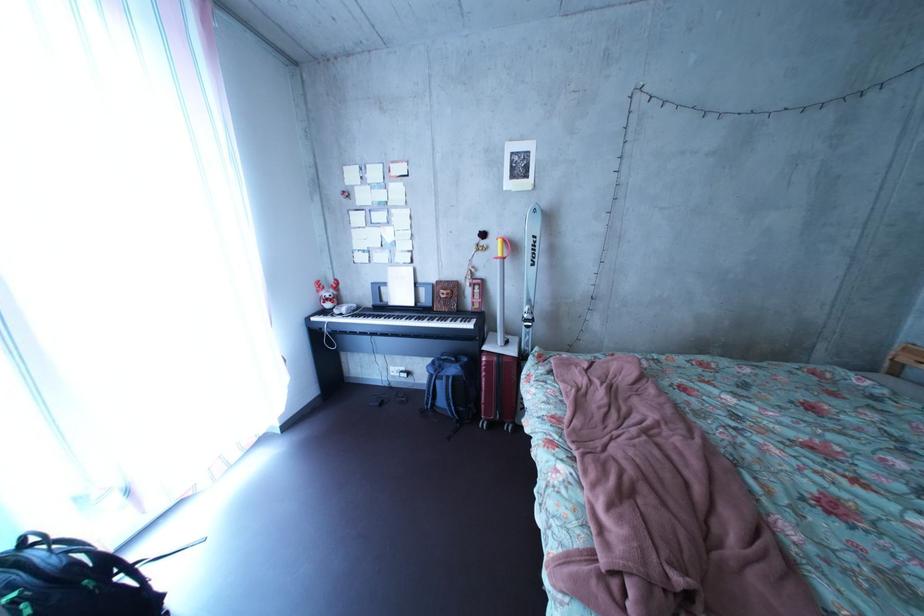
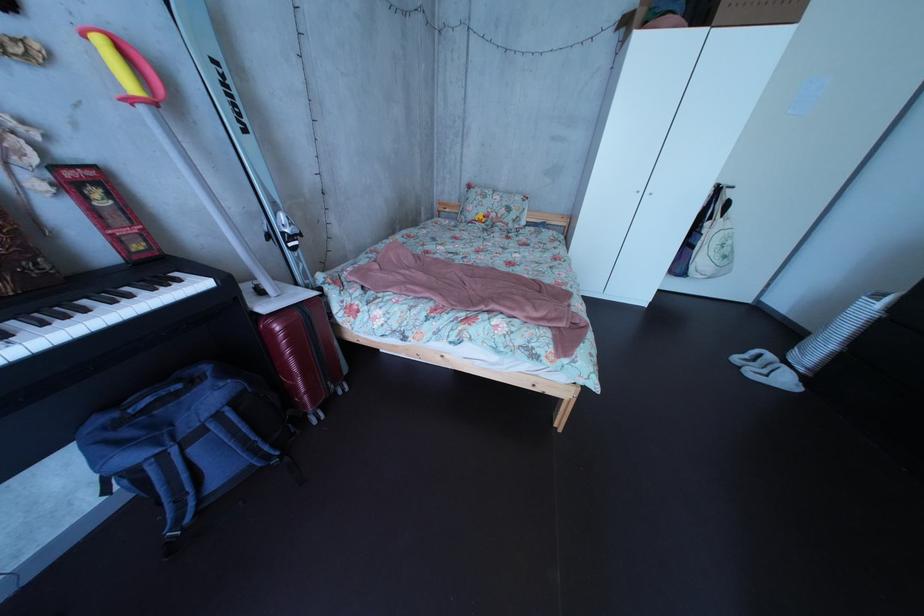
In the second image, find the point that corresponds to point (509, 367) in the first image.

(311, 322)